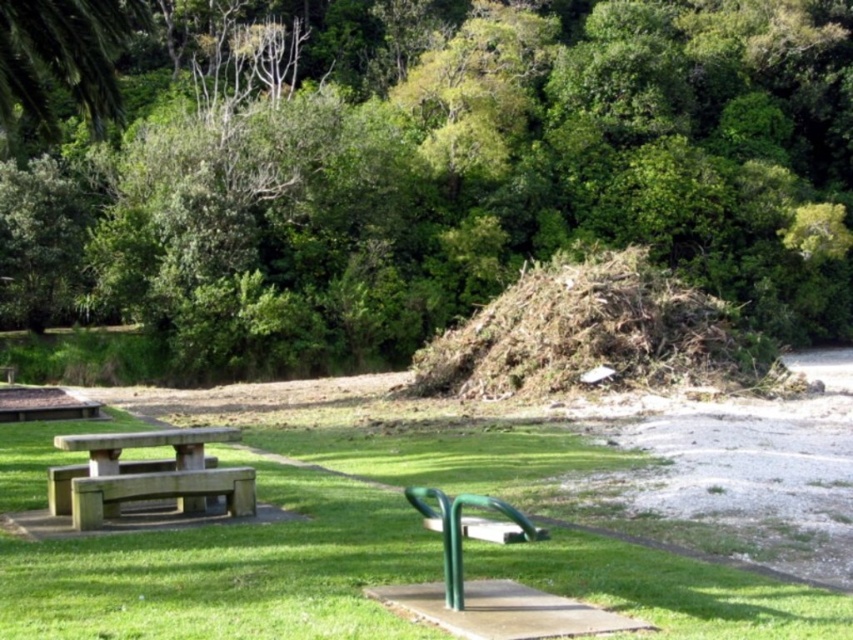
Can you confirm if green leafy tree at upper center is positioned to the left of green concrete bench at lower left?

No, green leafy tree at upper center is not to the left of green concrete bench at lower left.

Is green leafy tree at upper center above green concrete bench at lower left?

Yes, green leafy tree at upper center is above green concrete bench at lower left.

Find the location of a particular element. green leafy tree at upper center is located at coordinates (432, 176).

Between green leafy tree at upper center and wooden picnic table at lower left, which one has less height?

wooden picnic table at lower left

Does green leafy tree at upper center have a greater width compared to wooden picnic table at lower left?

Indeed, green leafy tree at upper center has a greater width compared to wooden picnic table at lower left.

Between point (416, 131) and point (158, 493), which one is positioned behind?

Point (416, 131)

At what (x,y) coordinates should I click in order to perform the action: click on green leafy tree at upper center. Please return your answer as a coordinate pair (x, y). Image resolution: width=853 pixels, height=640 pixels. Looking at the image, I should click on (432, 176).

Who is more forward, (x=343, y=344) or (x=531, y=440)?

Point (x=531, y=440) is more forward.

I want to click on green leafy tree at upper center, so click(x=432, y=176).